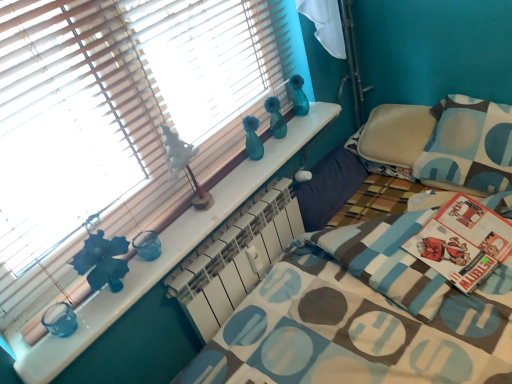
Identify the location of white matte table lamp at upper center. The width and height of the screenshot is (512, 384). (184, 166).

Measure the distance between blue and white patterned pillow at right and camera.

blue and white patterned pillow at right and camera are 1.62 meters apart from each other.

The height and width of the screenshot is (384, 512). Identify the location of blue and white patterned pillow at right. (469, 145).

What do you see at coordinates (114, 119) in the screenshot? I see `wooden blinds at upper left` at bounding box center [114, 119].

What is the approximate width of wooden blinds at upper left?

wooden blinds at upper left is 6.73 centimeters in width.

At what (x,y) coordinates should I click in order to perform the action: click on white matte table lamp at upper center. Please return your answer as a coordinate pair (x, y). The height and width of the screenshot is (384, 512). Looking at the image, I should click on (184, 166).

Based on the photo, from a real-world perspective, is white matte radiator at center positioned over white matte table lamp at upper center based on gravity?

No, from a real-world perspective, white matte radiator at center is not over white matte table lamp at upper center

Which object is positioned more to the left, white matte radiator at center or white matte table lamp at upper center?

From the viewer's perspective, white matte table lamp at upper center appears more on the left side.

Would you say white matte table lamp at upper center is part of white matte radiator at center's contents?

That's incorrect, white matte table lamp at upper center is not inside white matte radiator at center.

Measure the distance between white matte radiator at center and white matte table lamp at upper center.

white matte radiator at center is 31.61 centimeters away from white matte table lamp at upper center.

Which of these two, blue and white patterned pillow at right or wooden blinds at upper left, is bigger?

With larger size is wooden blinds at upper left.

Looking at this image, is blue and white patterned pillow at right to the left of wooden blinds at upper left from the viewer's perspective?

No.

Is blue and white patterned pillow at right inside the boundaries of wooden blinds at upper left, or outside?

blue and white patterned pillow at right is not inside wooden blinds at upper left, it's outside.

Considering the points (509, 129) and (153, 188), which point is behind, point (509, 129) or point (153, 188)?

Point (509, 129)

Does white matte radiator at center have a smaller size compared to wooden blinds at upper left?

Yes, white matte radiator at center is smaller than wooden blinds at upper left.

Could you tell me if white matte radiator at center is turned towards wooden blinds at upper left?

No, white matte radiator at center is not aimed at wooden blinds at upper left.

Is point (174, 294) closer or farther from the camera than point (49, 109)?

Point (174, 294) is positioned farther from the camera compared to point (49, 109).

Is there a large distance between white matte table lamp at upper center and blue and white patterned pillow at right?

white matte table lamp at upper center is far away from blue and white patterned pillow at right.

Consider the image. From the image's perspective, which one is positioned lower, white matte table lamp at upper center or blue and white patterned pillow at right?

white matte table lamp at upper center appears lower in the image.

Considering their positions, is white matte table lamp at upper center located in front of or behind blue and white patterned pillow at right?

white matte table lamp at upper center is positioned closer to the viewer than blue and white patterned pillow at right.

Is white matte table lamp at upper center to the left of blue and white patterned pillow at right from the viewer's perspective?

Yes, white matte table lamp at upper center is to the left of blue and white patterned pillow at right.

Is white matte radiator at center at the left side of blue and white patterned pillow at right?

Yes.

Is white matte radiator at center facing towards blue and white patterned pillow at right?

No, white matte radiator at center is not oriented towards blue and white patterned pillow at right.

Which of these two, white matte radiator at center or blue and white patterned pillow at right, stands taller?

blue and white patterned pillow at right is taller.

Looking at the image, does white matte table lamp at upper center seem bigger or smaller compared to white matte radiator at center?

Considering their sizes, white matte table lamp at upper center takes up less space than white matte radiator at center.

Does white matte table lamp at upper center turn towards white matte radiator at center?

No, white matte table lamp at upper center is not aimed at white matte radiator at center.

From the image's perspective, is white matte table lamp at upper center on top of white matte radiator at center?

Yes, from the image's perspective, white matte table lamp at upper center is on top of white matte radiator at center.

Which of these two, white matte table lamp at upper center or white matte radiator at center, is thinner?

white matte table lamp at upper center is thinner.

Consider the image. Which object is further away from the camera taking this photo, wooden blinds at upper left or blue and white patterned pillow at right?

blue and white patterned pillow at right.

Locate an element on the screen. This screenshot has height=384, width=512. pillow that appears below the wooden blinds at upper left (from a real-world perspective) is located at coordinates (469, 145).

From a real-world perspective, is wooden blinds at upper left on blue and white patterned pillow at right?

Correct, in the physical world, wooden blinds at upper left is higher than blue and white patterned pillow at right.

Is point (68, 158) more distant than point (508, 153)?

No, it is in front of (508, 153).

Where is `table lamp above the white matte radiator at center (from the image's perspective)`? The height and width of the screenshot is (384, 512). table lamp above the white matte radiator at center (from the image's perspective) is located at coordinates (184, 166).

Locate an element on the screen. window blind above the blue and white patterned pillow at right (from a real-world perspective) is located at coordinates (114, 119).

In the scene shown: When comparing their distances from white matte radiator at center, does white matte table lamp at upper center or blue and white patterned pillow at right seem further?

blue and white patterned pillow at right is further to white matte radiator at center.

Considering their positions, is white matte radiator at center positioned further to white matte table lamp at upper center than wooden blinds at upper left?

Among the two, white matte radiator at center is located further to white matte table lamp at upper center.

Consider the image. Estimate the real-world distances between objects in this image. Which object is further from white matte radiator at center, wooden blinds at upper left or white matte table lamp at upper center?

Based on the image, wooden blinds at upper left appears to be further to white matte radiator at center.

Looking at the image, which one is located closer to wooden blinds at upper left, white matte table lamp at upper center or blue and white patterned pillow at right?

The object closer to wooden blinds at upper left is white matte table lamp at upper center.

Looking at the image, which one is located closer to white matte table lamp at upper center, wooden blinds at upper left or blue and white patterned pillow at right?

wooden blinds at upper left lies closer to white matte table lamp at upper center than the other object.

When comparing their distances from white matte radiator at center, does white matte table lamp at upper center or wooden blinds at upper left seem closer?

white matte table lamp at upper center is closer to white matte radiator at center.

Estimate the real-world distances between objects in this image. Which object is further from white matte table lamp at upper center, blue and white patterned pillow at right or white matte radiator at center?

Among the two, blue and white patterned pillow at right is located further to white matte table lamp at upper center.

Considering their positions, is blue and white patterned pillow at right positioned closer to wooden blinds at upper left than white matte radiator at center?

white matte radiator at center is closer to wooden blinds at upper left.

Locate an element on the screen. This screenshot has height=384, width=512. table lamp between wooden blinds at upper left and blue and white patterned pillow at right in the horizontal direction is located at coordinates (184, 166).

Where is `radiator situated between white matte table lamp at upper center and blue and white patterned pillow at right from left to right`? The image size is (512, 384). radiator situated between white matte table lamp at upper center and blue and white patterned pillow at right from left to right is located at coordinates (237, 260).

Find the location of a particular element. Image resolution: width=512 pixels, height=384 pixels. table lamp between wooden blinds at upper left and white matte radiator at center along the z-axis is located at coordinates (184, 166).

Locate an element on the screen. The image size is (512, 384). radiator between wooden blinds at upper left and blue and white patterned pillow at right is located at coordinates (237, 260).